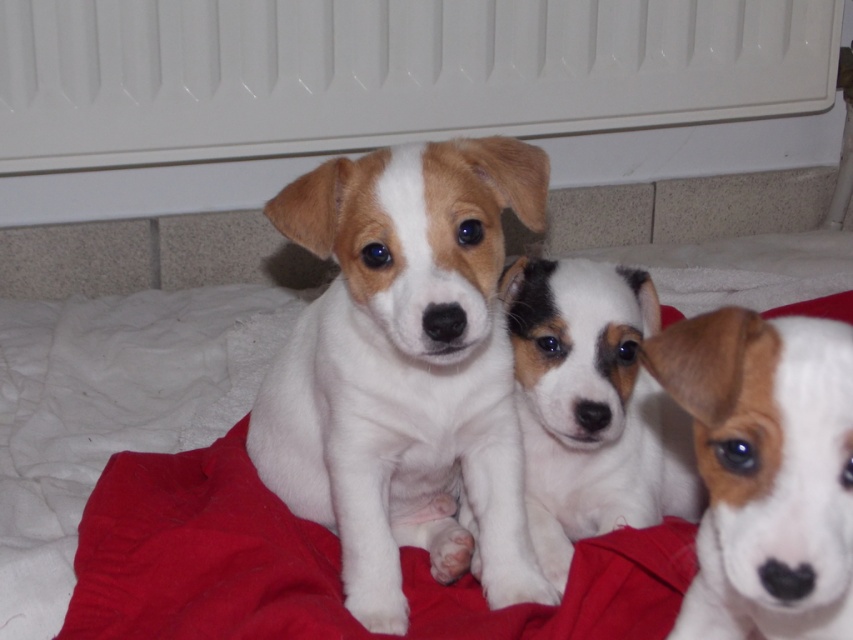
Question: Which point is farther to the camera?

Choices:
 (A) white fur puppy at center
 (B) white fur at center
 (C) red fabric blanket at center

Answer: (A)

Question: Considering the relative positions of white fur puppy at center and red fabric blanket at center in the image provided, where is white fur puppy at center located with respect to red fabric blanket at center?

Choices:
 (A) right
 (B) left

Answer: (A)

Question: Which point is farther to the camera?

Choices:
 (A) (473, 372)
 (B) (457, 596)

Answer: (A)

Question: Can you confirm if white fur puppy at center is wider than red fabric blanket at center?

Choices:
 (A) no
 (B) yes

Answer: (A)

Question: Which object is closer to the camera taking this photo?

Choices:
 (A) white fur puppy at center
 (B) red fabric blanket at center
 (C) white fur dog at center

Answer: (B)

Question: Can you confirm if white fur at center is positioned above white fur dog at center?

Choices:
 (A) yes
 (B) no

Answer: (B)